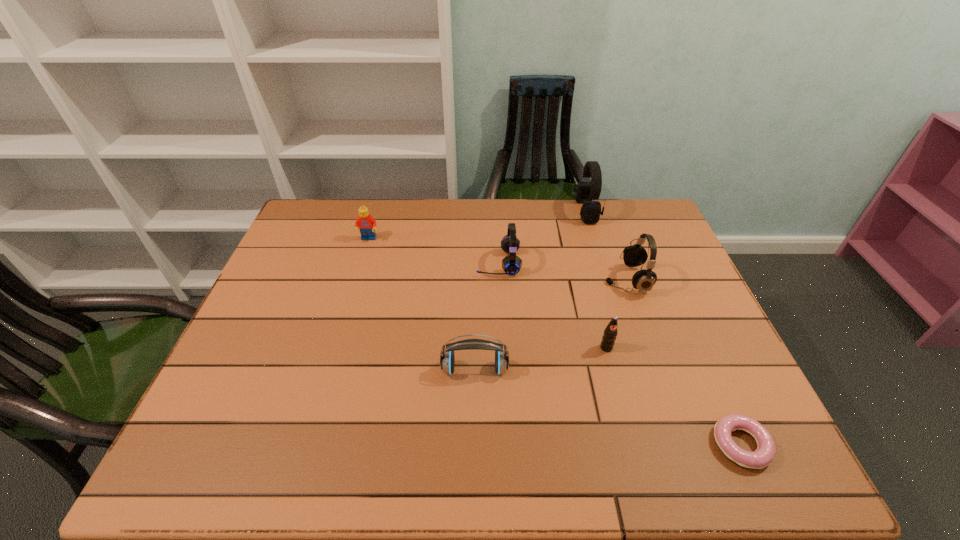
Identify the location of vacant region that satisfies the following two spatial constraints: 1. on the headband of the tallest headset; 2. on the front label of the third nearest object. The width and height of the screenshot is (960, 540). (628, 348).

Where is `blank area in the image that satisfies the following two spatial constraints: 1. on the headband of the tallest headset; 2. on the front label of the pop`? The width and height of the screenshot is (960, 540). blank area in the image that satisfies the following two spatial constraints: 1. on the headband of the tallest headset; 2. on the front label of the pop is located at coordinates (628, 348).

Image resolution: width=960 pixels, height=540 pixels. Find the location of `free spot that satisfies the following two spatial constraints: 1. on the face of the second farthest object; 2. on the right side of the shortest object`. free spot that satisfies the following two spatial constraints: 1. on the face of the second farthest object; 2. on the right side of the shortest object is located at coordinates (307, 445).

The width and height of the screenshot is (960, 540). I want to click on blank area in the image that satisfies the following two spatial constraints: 1. on the face of the doughnut; 2. on the left side of the Lego, so click(x=307, y=445).